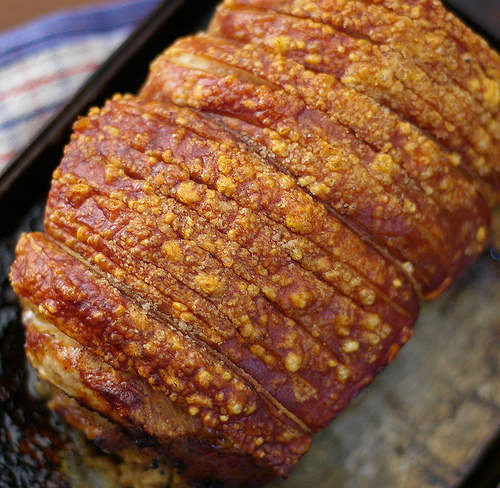
You are a GUI agent. You are given a task and a screenshot of the screen. Output one action in this format:
    pyautogui.click(x=<x>, y=<y>)
    Task: Click on the plaid cloth
    The width and height of the screenshot is (500, 488).
    Given the screenshot: What is the action you would take?
    pyautogui.click(x=59, y=74)